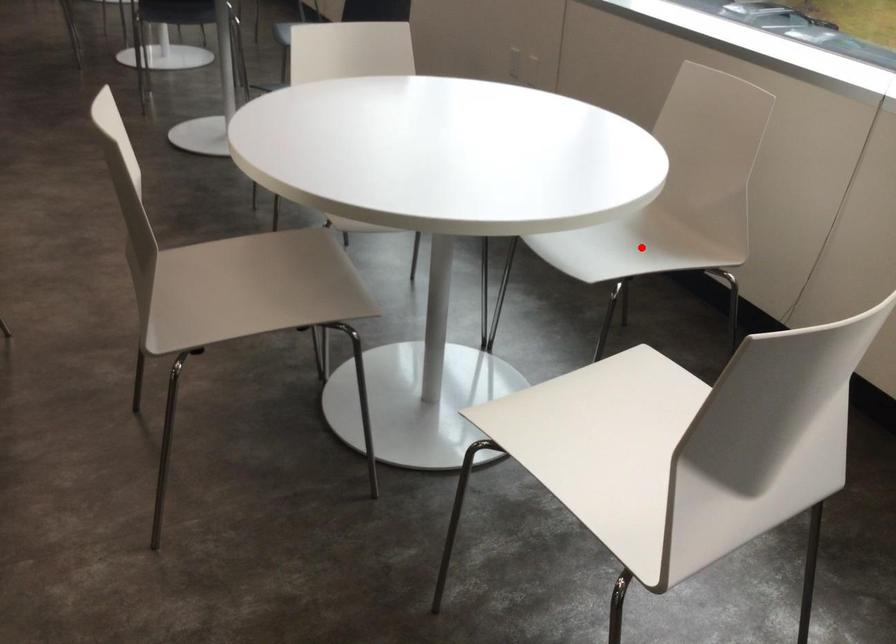
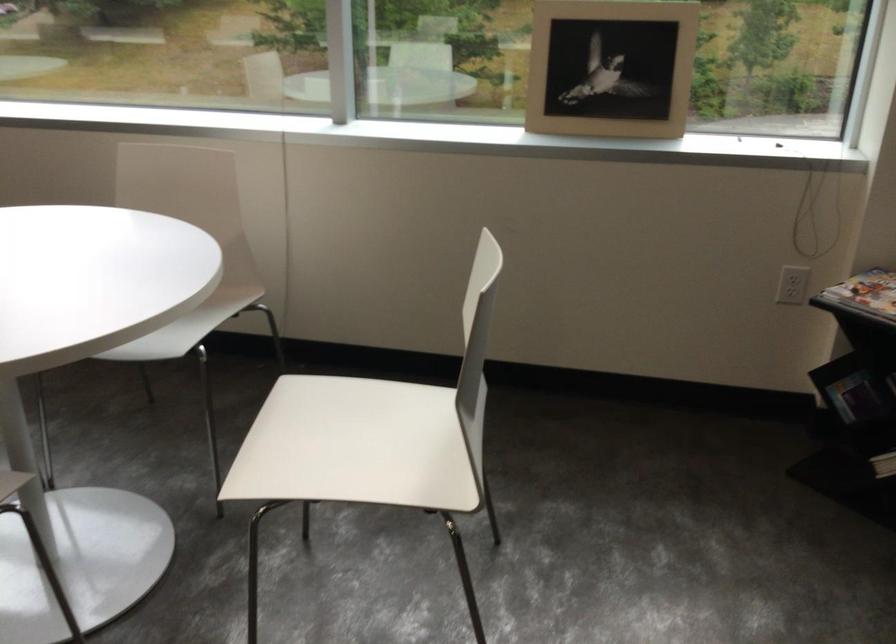
Question: I am providing you with two images of the same scene from different viewpoints. A red point is marked on the first image. At the location where the point appears in image 1, is it still visible in image 2?

Choices:
 (A) Yes
 (B) No

Answer: (B)